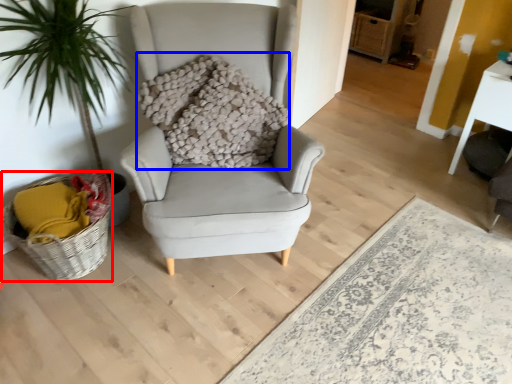
Question: Which point is closer to the camera, basket (highlighted by a red box) or pillow (highlighted by a blue box)?

Choices:
 (A) basket
 (B) pillow

Answer: (A)